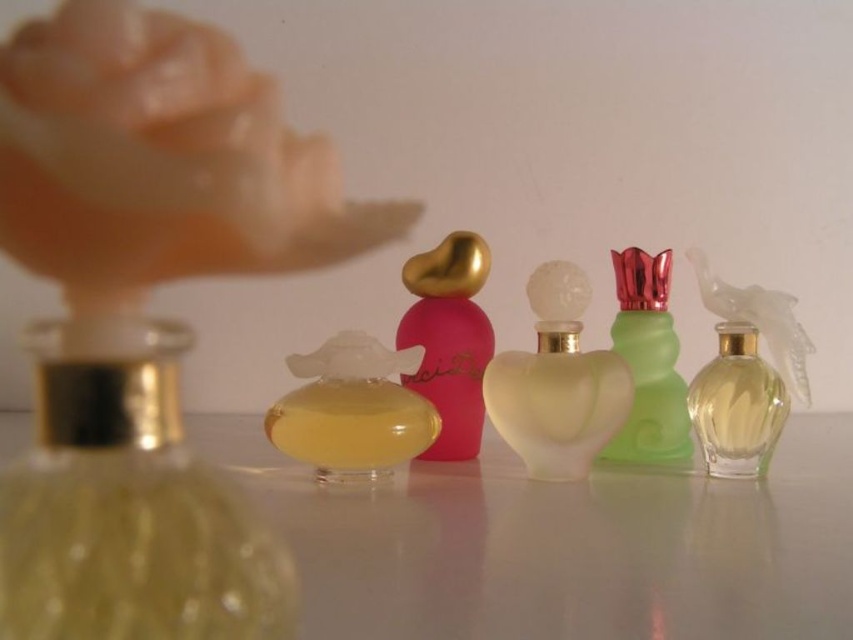
Is pink glossy perfume at center below green frosted glass perfume at center right?

Indeed, pink glossy perfume at center is positioned under green frosted glass perfume at center right.

Does pink glossy perfume at center have a larger size compared to green frosted glass perfume at center right?

Actually, pink glossy perfume at center might be smaller than green frosted glass perfume at center right.

Is point (416, 253) positioned in front of point (630, 356)?

No.

The width and height of the screenshot is (853, 640). I want to click on pink glossy perfume at center, so click(450, 339).

Is translucent yellow glass at left thinner than translucent glass heart-shaped perfume at center?

Indeed, translucent yellow glass at left has a lesser width compared to translucent glass heart-shaped perfume at center.

Describe the element at coordinates (129, 512) in the screenshot. I see `translucent yellow glass at left` at that location.

This screenshot has height=640, width=853. What are the coordinates of `translucent yellow glass at left` in the screenshot? It's located at (129, 512).

Is point (53, 384) farther from camera compared to point (32, 51)?

Yes.

Where is `translucent yellow glass at left`? The height and width of the screenshot is (640, 853). translucent yellow glass at left is located at coordinates (129, 512).

Is point (164, 620) farther from camera compared to point (210, 250)?

Yes, point (164, 620) is farther from viewer.

At what (x,y) coordinates should I click in order to perform the action: click on translucent yellow glass at left. Please return your answer as a coordinate pair (x, y). The height and width of the screenshot is (640, 853). Looking at the image, I should click on (129, 512).